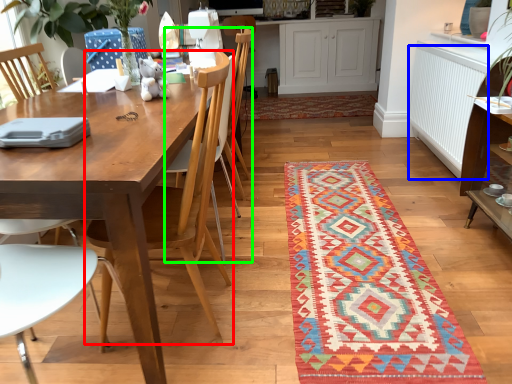
Question: Estimate the real-world distances between objects in this image. Which object is closer to chair (highlighted by a red box), radiator (highlighted by a blue box) or armchair (highlighted by a green box)?

Choices:
 (A) radiator
 (B) armchair

Answer: (B)